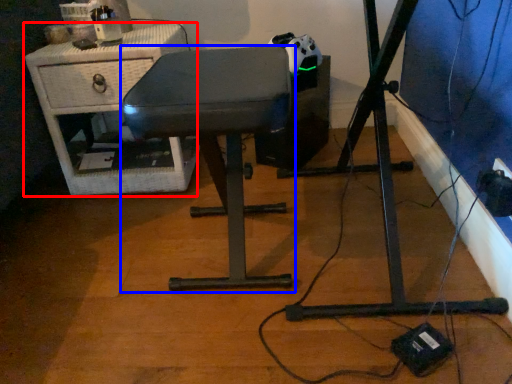
Question: Which object appears farthest to the camera in this image, furniture (highlighted by a red box) or furniture (highlighted by a blue box)?

Choices:
 (A) furniture
 (B) furniture

Answer: (A)